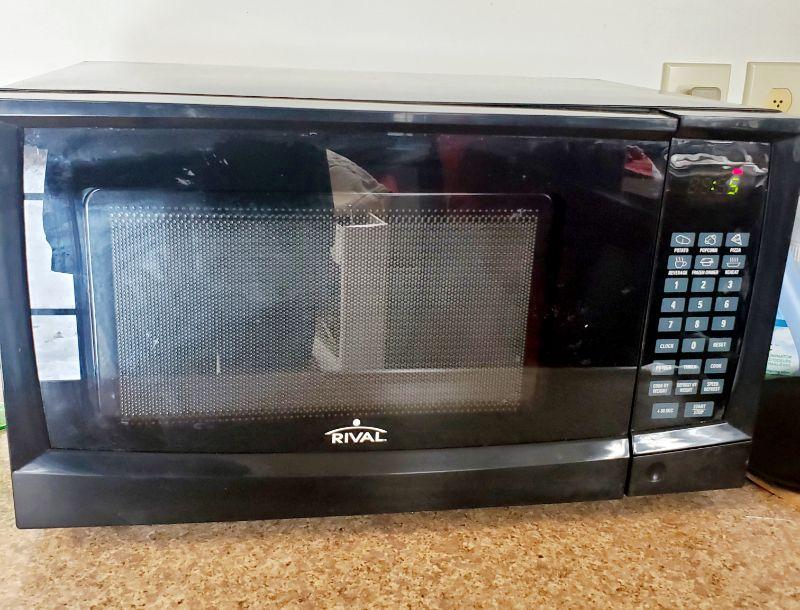
Image resolution: width=800 pixels, height=610 pixels. I want to click on window, so click(x=57, y=323).